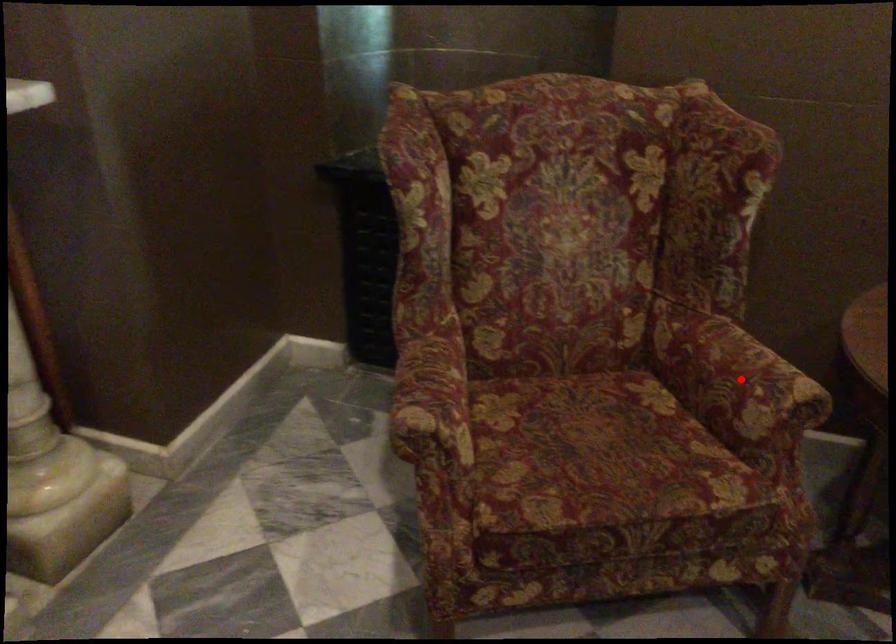
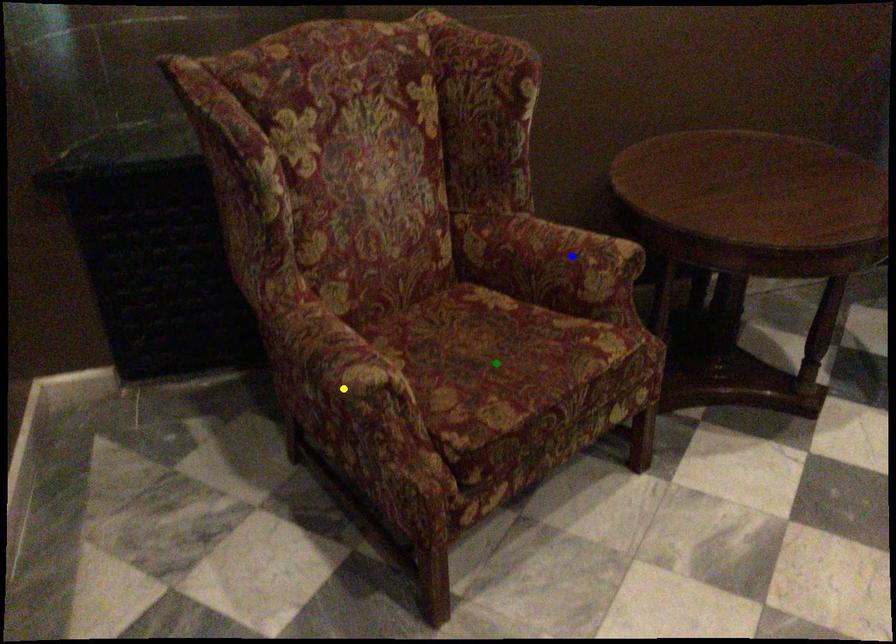
Question: I am providing you with two images of the same scene from different viewpoints. A red point is marked on the first image. You are given multiple points on the second image. Which spot in image 2 lines up with the point in image 1?

Choices:
 (A) yellow point
 (B) green point
 (C) blue point

Answer: (C)